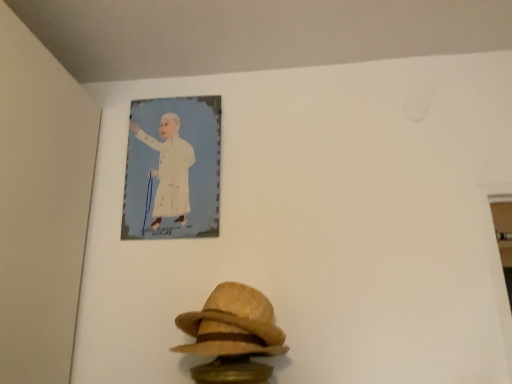
You are a GUI agent. You are given a task and a screenshot of the screen. Output one action in this format:
    pyautogui.click(x=<x>, y=<y>)
    Task: Click on the white paper portrait at upper center
    Image resolution: width=512 pixels, height=384 pixels.
    Given the screenshot: What is the action you would take?
    pyautogui.click(x=169, y=169)

What do you see at coordinates (169, 169) in the screenshot? I see `white paper portrait at upper center` at bounding box center [169, 169].

Measure the distance between white paper portrait at upper center and camera.

white paper portrait at upper center is 4.64 feet from camera.

What do you see at coordinates (232, 324) in the screenshot?
I see `felt straw fedora at lower center` at bounding box center [232, 324].

At what (x,y) coordinates should I click in order to perform the action: click on felt straw fedora at lower center. Please return your answer as a coordinate pair (x, y). Image resolution: width=512 pixels, height=384 pixels. Looking at the image, I should click on (232, 324).

This screenshot has height=384, width=512. Find the location of `white paper portrait at upper center`. white paper portrait at upper center is located at coordinates (169, 169).

Can you confirm if white paper portrait at upper center is positioned to the left of felt straw fedora at lower center?

Yes.

Is white paper portrait at upper center in front of or behind felt straw fedora at lower center in the image?

Visually, white paper portrait at upper center is located behind felt straw fedora at lower center.

Is point (165, 153) farther from camera compared to point (236, 316)?

Yes, point (165, 153) is behind point (236, 316).

From the image's perspective, between white paper portrait at upper center and felt straw fedora at lower center, which one is located above?

white paper portrait at upper center is shown above in the image.

From a real-world perspective, relative to felt straw fedora at lower center, is white paper portrait at upper center vertically above or below?

From a real-world perspective, white paper portrait at upper center is physically above felt straw fedora at lower center.

Between white paper portrait at upper center and felt straw fedora at lower center, which one has smaller width?

With smaller width is white paper portrait at upper center.

Which of these two, white paper portrait at upper center or felt straw fedora at lower center, stands taller?

white paper portrait at upper center is taller.

Between white paper portrait at upper center and felt straw fedora at lower center, which one has larger size?

Bigger between the two is felt straw fedora at lower center.

Looking at this image, can felt straw fedora at lower center be found inside white paper portrait at upper center?

No, felt straw fedora at lower center is not a part of white paper portrait at upper center.

Is white paper portrait at upper center not close to felt straw fedora at lower center?

That's not correct — white paper portrait at upper center is a little close to felt straw fedora at lower center.

Is white paper portrait at upper center aimed at felt straw fedora at lower center?

No, white paper portrait at upper center is not aimed at felt straw fedora at lower center.

How many degrees apart are the facing directions of white paper portrait at upper center and felt straw fedora at lower center?

white paper portrait at upper center and felt straw fedora at lower center are facing 6.51 degrees away from each other.

Measure the distance from white paper portrait at upper center to felt straw fedora at lower center.

18.02 inches.

Identify the location of fedora that appears in front of the white paper portrait at upper center. The image size is (512, 384). (232, 324).

Is felt straw fedora at lower center to the left of white paper portrait at upper center from the viewer's perspective?

In fact, felt straw fedora at lower center is to the right of white paper portrait at upper center.

In the image, is felt straw fedora at lower center positioned in front of or behind white paper portrait at upper center?

Answer: In the image, felt straw fedora at lower center appears in front of white paper portrait at upper center.

Considering the points (230, 308) and (169, 213), which point is in front, point (230, 308) or point (169, 213)?

The point (230, 308) is closer to the camera.

From the image's perspective, is felt straw fedora at lower center positioned above or below white paper portrait at upper center?

From the image's perspective, felt straw fedora at lower center appears below white paper portrait at upper center.

From a real-world perspective, is felt straw fedora at lower center on top of white paper portrait at upper center?

No, from a real-world perspective, felt straw fedora at lower center is not above white paper portrait at upper center.

Considering the sizes of felt straw fedora at lower center and white paper portrait at upper center in the image, is felt straw fedora at lower center wider or thinner than white paper portrait at upper center?

felt straw fedora at lower center is wider than white paper portrait at upper center.

Which of these two, felt straw fedora at lower center or white paper portrait at upper center, stands taller?

white paper portrait at upper center.

Considering the relative sizes of felt straw fedora at lower center and white paper portrait at upper center in the image provided, is felt straw fedora at lower center bigger than white paper portrait at upper center?

Yes.

Is felt straw fedora at lower center completely or partially outside of white paper portrait at upper center?

Absolutely, felt straw fedora at lower center is external to white paper portrait at upper center.

Is felt straw fedora at lower center not near white paper portrait at upper center?

No.

Looking at this image, is felt straw fedora at lower center facing towards white paper portrait at upper center?

No, felt straw fedora at lower center is not oriented towards white paper portrait at upper center.

Can you tell me how much felt straw fedora at lower center and white paper portrait at upper center differ in facing direction?

There is a 6.51-degree angle between the facing directions of felt straw fedora at lower center and white paper portrait at upper center.

How far apart are felt straw fedora at lower center and white paper portrait at upper center?

felt straw fedora at lower center is 18.02 inches from white paper portrait at upper center.

I want to click on fedora on the right of white paper portrait at upper center, so click(232, 324).

Where is `fedora in front of the white paper portrait at upper center`? The height and width of the screenshot is (384, 512). fedora in front of the white paper portrait at upper center is located at coordinates (232, 324).

This screenshot has width=512, height=384. What are the coordinates of `person above the felt straw fedora at lower center (from a real-world perspective)` in the screenshot? It's located at (169, 169).